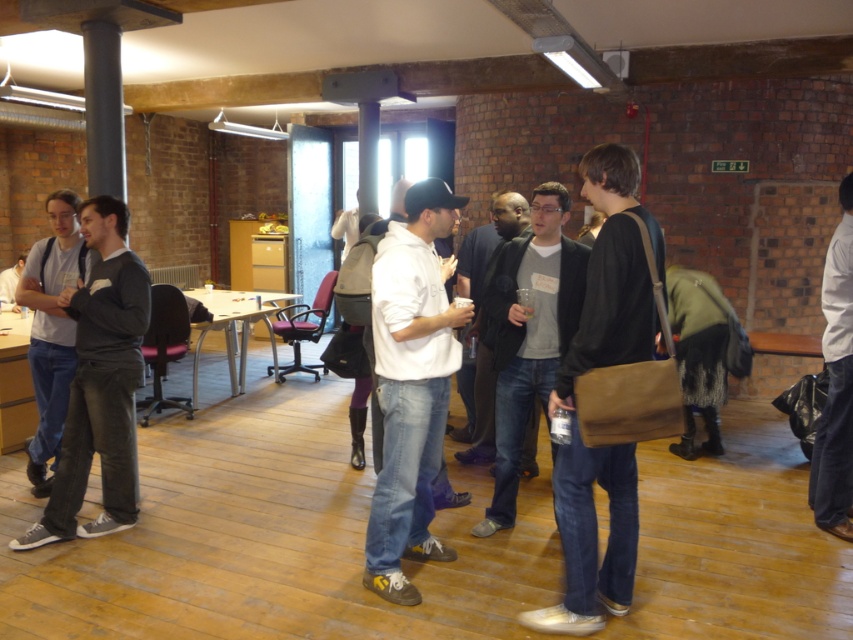
Can you confirm if gray cotton hoodie at center is bigger than white matte jacket at right?

Correct, gray cotton hoodie at center is larger in size than white matte jacket at right.

Between gray cotton hoodie at center and white matte jacket at right, which one has less height?

With less height is gray cotton hoodie at center.

Which is behind, point (549, 314) or point (822, 508)?

Positioned behind is point (822, 508).

The image size is (853, 640). What are the coordinates of `gray cotton hoodie at center` in the screenshot? It's located at (527, 333).

Is dark brown leather jacket at center closer to the viewer compared to dark gray jacket at center?

Yes, dark brown leather jacket at center is closer to the viewer.

From the picture: Who is more forward, (614,541) or (480,384)?

Positioned in front is point (614,541).

Locate an element on the screen. This screenshot has height=640, width=853. dark brown leather jacket at center is located at coordinates (612, 275).

Is gray cotton hoodie at center to the right of white hoodie at center from the viewer's perspective?

Yes, gray cotton hoodie at center is to the right of white hoodie at center.

Is gray cotton hoodie at center smaller than white hoodie at center?

Correct, gray cotton hoodie at center occupies less space than white hoodie at center.

Which is behind, point (498, 275) or point (0, 276)?

Point (0, 276)

You are a GUI agent. You are given a task and a screenshot of the screen. Output one action in this format:
    pyautogui.click(x=<x>, y=<y>)
    Task: Click on the gray cotton hoodie at center
    The image size is (853, 640).
    Given the screenshot: What is the action you would take?
    pyautogui.click(x=527, y=333)